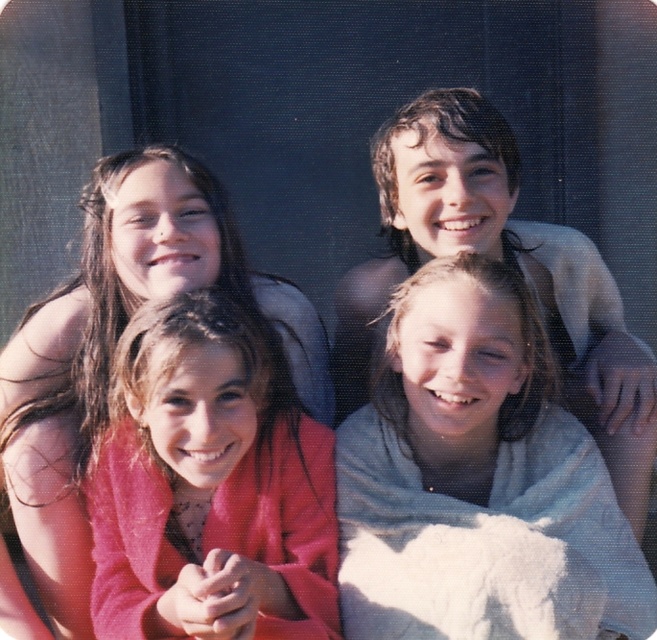
What do you see at coordinates (210, 488) in the screenshot?
I see `matte pink sweater at center` at bounding box center [210, 488].

In the scene shown: Is matte pink sweater at center positioned before light gray towel at upper right?

Yes, matte pink sweater at center is in front of light gray towel at upper right.

Is point (122, 616) positioned after point (602, 333)?

No, it is not.

Locate an element on the screen. Image resolution: width=657 pixels, height=640 pixels. matte pink sweater at center is located at coordinates (210, 488).